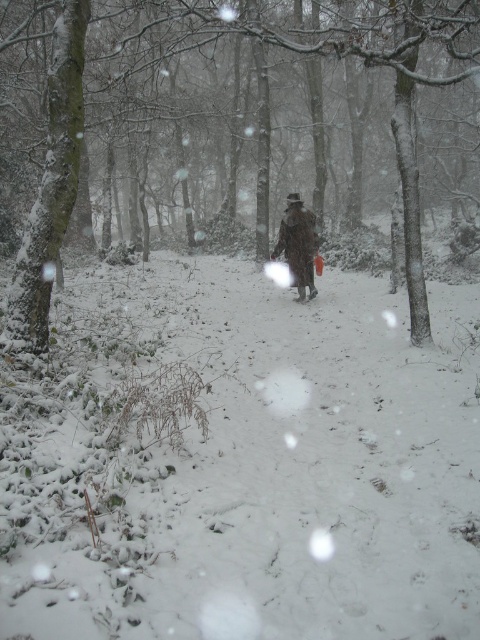
Does white fluffy snow at center have a lesser height compared to brown wool coat at center?

Yes, white fluffy snow at center is shorter than brown wool coat at center.

Between point (297, 458) and point (311, 236), which one is positioned in front?

Point (297, 458)

This screenshot has width=480, height=640. I want to click on white fluffy snow at center, so click(x=243, y=464).

Does snow-covered bark tree at left have a greater height compared to brown wool coat at center?

Indeed, snow-covered bark tree at left has a greater height compared to brown wool coat at center.

Is snow-covered bark tree at left above brown wool coat at center?

Correct, snow-covered bark tree at left is located above brown wool coat at center.

What do you see at coordinates (228, 113) in the screenshot? I see `snow-covered bark tree at left` at bounding box center [228, 113].

The image size is (480, 640). Find the location of `snow-covered bark tree at left`. snow-covered bark tree at left is located at coordinates (228, 113).

Does white fluffy snow at center have a larger size compared to snow-covered bark tree at left?

Actually, white fluffy snow at center might be smaller than snow-covered bark tree at left.

Does white fluffy snow at center appear under snow-covered bark tree at left?

Indeed, white fluffy snow at center is positioned under snow-covered bark tree at left.

At what (x,y) coordinates should I click in order to perform the action: click on white fluffy snow at center. Please return your answer as a coordinate pair (x, y). Image resolution: width=480 pixels, height=640 pixels. Looking at the image, I should click on (243, 464).